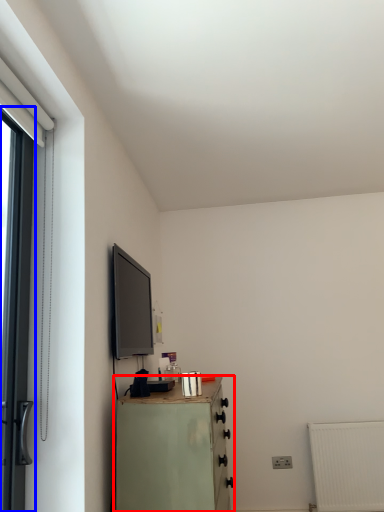
Question: Which point is further to the camera, chest of drawers (highlighted by a red box) or door (highlighted by a blue box)?

Choices:
 (A) chest of drawers
 (B) door

Answer: (A)